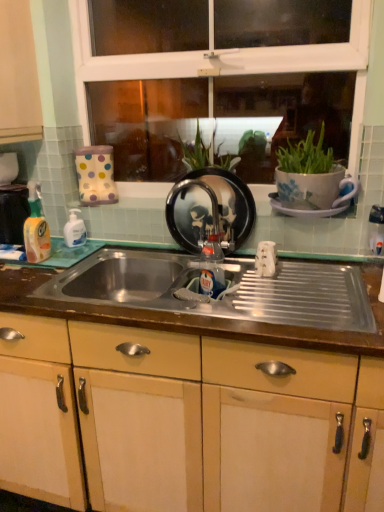
Question: Could you tell me if yellow translucent liquid at left, placed as the first bottle when sorted from left to right, is facing metallic stainless steel sink at center?

Choices:
 (A) no
 (B) yes

Answer: (B)

Question: Does yellow translucent liquid at left, the third bottle positioned from the right, have a smaller size compared to metallic stainless steel sink at center?

Choices:
 (A) yes
 (B) no

Answer: (A)

Question: Can you see yellow translucent liquid at left, placed as the first bottle when sorted from left to right, touching metallic stainless steel sink at center?

Choices:
 (A) no
 (B) yes

Answer: (A)

Question: Is yellow translucent liquid at left, placed as the first bottle when sorted from left to right, looking in the opposite direction of metallic stainless steel sink at center?

Choices:
 (A) no
 (B) yes

Answer: (A)

Question: Is yellow translucent liquid at left, placed as the first bottle when sorted from left to right, far away from metallic stainless steel sink at center?

Choices:
 (A) no
 (B) yes

Answer: (A)

Question: In the image, is white glossy bottle at left, the 2th bottle viewed from the left, on the left side or the right side of matte wood cabinetry at center, the first cabinetry from the right?

Choices:
 (A) left
 (B) right

Answer: (A)

Question: From the image's perspective, is white glossy bottle at left, the 2th bottle viewed from the left, above or below matte wood cabinetry at center, the first cabinetry from the right?

Choices:
 (A) below
 (B) above

Answer: (B)

Question: Is white glossy bottle at left, the 2th bottle viewed from the left, situated inside matte wood cabinetry at center, acting as the second cabinetry starting from the left, or outside?

Choices:
 (A) inside
 (B) outside

Answer: (B)

Question: In the image, is white glossy bottle at left, the 2th bottle in the right-to-left sequence, positioned in front of or behind matte wood cabinetry at center, the 1th cabinetry from the bottom?

Choices:
 (A) front
 (B) behind

Answer: (B)

Question: From the image's perspective, is metallic stainless steel sink at center located above or below black glossy frying pan at center?

Choices:
 (A) above
 (B) below

Answer: (B)

Question: Looking at the image, does metallic stainless steel sink at center seem bigger or smaller compared to black glossy frying pan at center?

Choices:
 (A) big
 (B) small

Answer: (A)

Question: Is metallic stainless steel sink at center situated inside black glossy frying pan at center or outside?

Choices:
 (A) inside
 (B) outside

Answer: (B)

Question: From a real-world perspective, is metallic stainless steel sink at center physically located above or below black glossy frying pan at center?

Choices:
 (A) above
 (B) below

Answer: (B)

Question: Is yellow translucent liquid at left, placed as the first bottle when sorted from left to right, situated inside white glossy bottle at left, the 2th bottle in the right-to-left sequence, or outside?

Choices:
 (A) inside
 (B) outside

Answer: (B)

Question: Considering the relative positions of yellow translucent liquid at left, the third bottle positioned from the right, and white glossy bottle at left, the 2th bottle in the right-to-left sequence, in the image provided, is yellow translucent liquid at left, the third bottle positioned from the right, to the left or to the right of white glossy bottle at left, the 2th bottle in the right-to-left sequence,?

Choices:
 (A) left
 (B) right

Answer: (A)